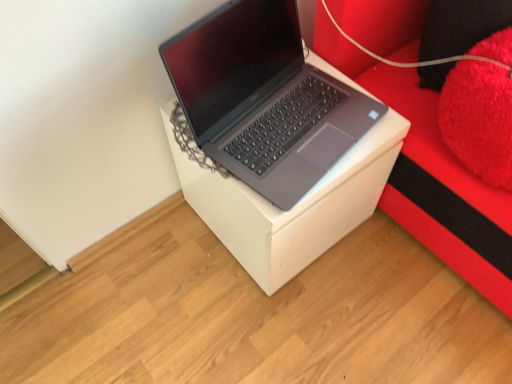
Question: Should I look upward or downward to see sleek silver laptop at center?

Choices:
 (A) up
 (B) down

Answer: (A)

Question: Can you confirm if white cardboard box at center is wider than sleek silver laptop at center?

Choices:
 (A) yes
 (B) no

Answer: (A)

Question: Would you consider white cardboard box at center to be distant from sleek silver laptop at center?

Choices:
 (A) yes
 (B) no

Answer: (B)

Question: Does white cardboard box at center come behind sleek silver laptop at center?

Choices:
 (A) no
 (B) yes

Answer: (B)

Question: Is white cardboard box at center to the right of sleek silver laptop at center from the viewer's perspective?

Choices:
 (A) yes
 (B) no

Answer: (B)

Question: From the image's perspective, would you say white cardboard box at center is positioned over sleek silver laptop at center?

Choices:
 (A) no
 (B) yes

Answer: (A)

Question: Does white cardboard box at center have a lesser width compared to sleek silver laptop at center?

Choices:
 (A) yes
 (B) no

Answer: (B)

Question: Does black fuzzy pillow at upper right, which is counted as the first pillow, starting from the top, have a greater width compared to sleek silver laptop at center?

Choices:
 (A) yes
 (B) no

Answer: (B)

Question: Is sleek silver laptop at center completely or partially inside black fuzzy pillow at upper right, which is counted as the first pillow, starting from the top?

Choices:
 (A) yes
 (B) no

Answer: (B)

Question: Can you confirm if black fuzzy pillow at upper right, which appears as the 2th pillow when ordered from the bottom, is bigger than sleek silver laptop at center?

Choices:
 (A) no
 (B) yes

Answer: (A)

Question: Does black fuzzy pillow at upper right, which appears as the 2th pillow when ordered from the bottom, appear on the right side of sleek silver laptop at center?

Choices:
 (A) yes
 (B) no

Answer: (A)

Question: Is black fuzzy pillow at upper right, which appears as the 2th pillow when ordered from the bottom, behind sleek silver laptop at center?

Choices:
 (A) yes
 (B) no

Answer: (A)

Question: Would you consider black fuzzy pillow at upper right, which is counted as the first pillow, starting from the top, to be distant from sleek silver laptop at center?

Choices:
 (A) yes
 (B) no

Answer: (B)

Question: Can you confirm if white cardboard box at center is smaller than black fuzzy pillow at upper right, which is counted as the first pillow, starting from the top?

Choices:
 (A) no
 (B) yes

Answer: (A)